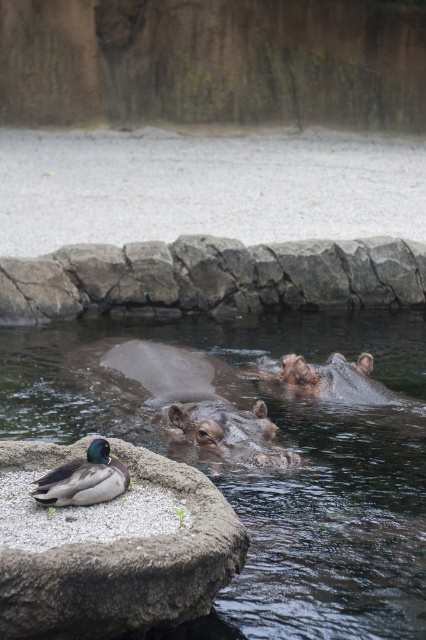
Is clear water at hippo center bigger than green glossy duck at lower left?

Yes.

Locate an element on the screen. The width and height of the screenshot is (426, 640). clear water at hippo center is located at coordinates (270, 468).

Which is behind, point (101, 428) or point (46, 484)?

Point (101, 428)

What are the coordinates of `clear water at hippo center` in the screenshot? It's located at (270, 468).

Who is positioned more to the left, gray rough stone at lower left or green glossy duck at lower left?

green glossy duck at lower left

Does point (57, 600) lie in front of point (100, 483)?

Yes, it is in front of point (100, 483).

At what (x,y) coordinates should I click in order to perform the action: click on gray rough stone at lower left. Please return your answer as a coordinate pair (x, y). The width and height of the screenshot is (426, 640). Looking at the image, I should click on (126, 568).

At what (x,y) coordinates should I click in order to perform the action: click on clear water at hippo center. Please return your answer as a coordinate pair (x, y). The image size is (426, 640). Looking at the image, I should click on [270, 468].

Is point (296, 515) positioned after point (127, 576)?

Yes.

Where is `clear water at hippo center`? The width and height of the screenshot is (426, 640). clear water at hippo center is located at coordinates (270, 468).